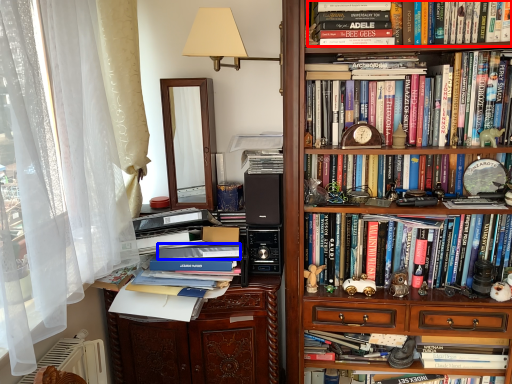
Question: Which point is closer to the camera, book (highlighted by a red box) or paperback book (highlighted by a blue box)?

Choices:
 (A) book
 (B) paperback book

Answer: (A)